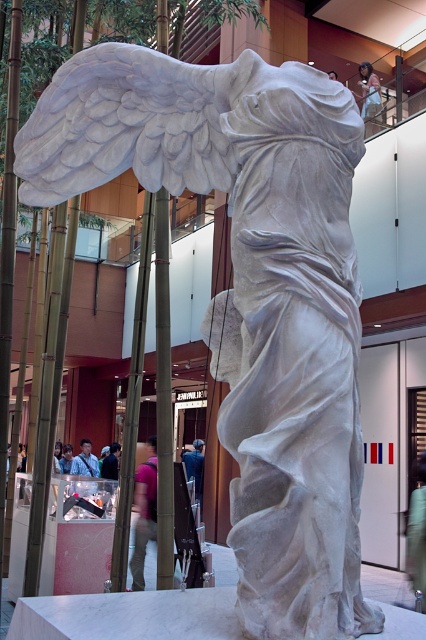
Question: Is pink fabric pants at center wider than light brown wooden chair at upper center?

Choices:
 (A) no
 (B) yes

Answer: (A)

Question: Which object is farther from the camera taking this photo?

Choices:
 (A) light brown wooden chair at upper center
 (B) pink fabric pants at center

Answer: (A)

Question: Which of the following is the closest to the observer?

Choices:
 (A) (368, 88)
 (B) (140, 467)

Answer: (B)

Question: Is pink fabric pants at center thinner than light brown wooden chair at upper center?

Choices:
 (A) yes
 (B) no

Answer: (A)

Question: Among these objects, which one is farthest from the camera?

Choices:
 (A) light brown wooden chair at upper center
 (B) pink fabric pants at center

Answer: (A)

Question: Can you confirm if pink fabric pants at center is positioned above light brown wooden chair at upper center?

Choices:
 (A) no
 (B) yes

Answer: (A)